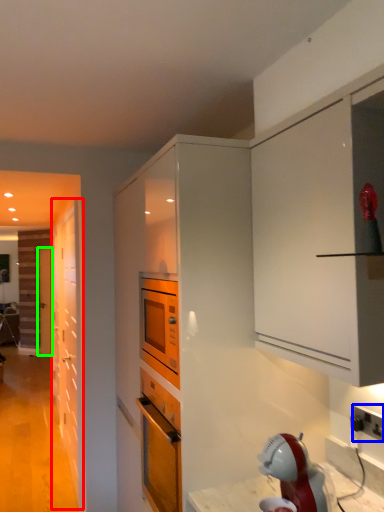
Question: Which object is positioned closest to door (highlighted by a red box)? Select from electric outlet (highlighted by a blue box) and door (highlighted by a green box).

Choices:
 (A) electric outlet
 (B) door

Answer: (B)